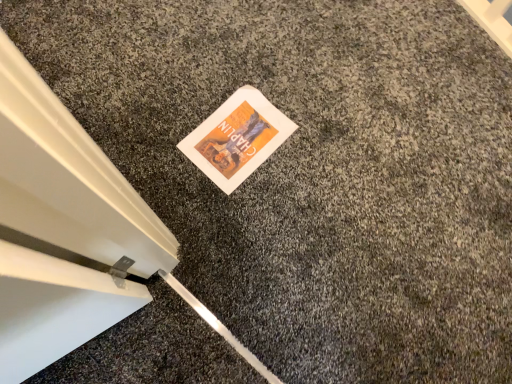
What do you see at coordinates (237, 138) in the screenshot? The width and height of the screenshot is (512, 384). I see `white paper at center` at bounding box center [237, 138].

Where is `white paper at center`? The width and height of the screenshot is (512, 384). white paper at center is located at coordinates (237, 138).

Measure the distance between white paper at center and camera.

A distance of 1.20 meters exists between white paper at center and camera.

Locate an element on the screen. This screenshot has width=512, height=384. white paper at center is located at coordinates (237, 138).